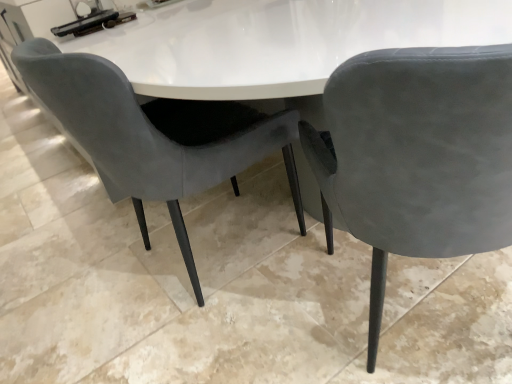
Describe the element at coordinates (155, 135) in the screenshot. The height and width of the screenshot is (384, 512). I see `suede gray chair at center, which is the 2th chair from right to left` at that location.

This screenshot has width=512, height=384. I want to click on suede gray chair at center, acting as the 1th chair starting from the left, so click(155, 135).

The image size is (512, 384). Describe the element at coordinates (417, 156) in the screenshot. I see `suede gray chair at center, which ranks as the second chair in left-to-right order` at that location.

What is the approximate height of suede gray chair at center, the first chair when ordered from right to left?

It is 32.70 inches.

Measure the distance between point [394,86] and camera.

They are 21.57 inches apart.

This screenshot has height=384, width=512. What are the coordinates of `suede gray chair at center, the first chair when ordered from right to left` in the screenshot? It's located at pyautogui.click(x=417, y=156).

At what (x,y) coordinates should I click in order to perform the action: click on suede gray chair at center, acting as the 1th chair starting from the left. Please return your answer as a coordinate pair (x, y). This screenshot has height=384, width=512. Looking at the image, I should click on tap(155, 135).

Based on their positions, is suede gray chair at center, which is the 2th chair from right to left, located to the left or right of suede gray chair at center, which ranks as the second chair in left-to-right order?

In the image, suede gray chair at center, which is the 2th chair from right to left, appears on the left side of suede gray chair at center, which ranks as the second chair in left-to-right order.

Considering their positions, is suede gray chair at center, acting as the 1th chair starting from the left, located in front of or behind suede gray chair at center, the first chair when ordered from right to left?

suede gray chair at center, acting as the 1th chair starting from the left, is positioned farther from the viewer than suede gray chair at center, the first chair when ordered from right to left.

Which is more distant, (x=136, y=147) or (x=458, y=202)?

The point (x=136, y=147) is farther from the camera.

From the image's perspective, between suede gray chair at center, which is the 2th chair from right to left, and suede gray chair at center, the first chair when ordered from right to left, who is located below?

suede gray chair at center, the first chair when ordered from right to left, is shown below in the image.

From a real-world perspective, is suede gray chair at center, which is the 2th chair from right to left, on top of suede gray chair at center, which ranks as the second chair in left-to-right order?

Yes, from a real-world perspective, suede gray chair at center, which is the 2th chair from right to left, is on top of suede gray chair at center, which ranks as the second chair in left-to-right order.

Can you confirm if suede gray chair at center, acting as the 1th chair starting from the left, is wider than suede gray chair at center, the first chair when ordered from right to left?

Incorrect, the width of suede gray chair at center, acting as the 1th chair starting from the left, does not surpass that of suede gray chair at center, the first chair when ordered from right to left.

Which of these two, suede gray chair at center, acting as the 1th chair starting from the left, or suede gray chair at center, which ranks as the second chair in left-to-right order, stands taller?

suede gray chair at center, which ranks as the second chair in left-to-right order.

Does suede gray chair at center, which is the 2th chair from right to left, have a larger size compared to suede gray chair at center, which ranks as the second chair in left-to-right order?

Indeed, suede gray chair at center, which is the 2th chair from right to left, has a larger size compared to suede gray chair at center, which ranks as the second chair in left-to-right order.

Is suede gray chair at center, which is the 2th chair from right to left, inside the boundaries of suede gray chair at center, the first chair when ordered from right to left, or outside?

suede gray chair at center, which is the 2th chair from right to left, lies outside suede gray chair at center, the first chair when ordered from right to left.

Is suede gray chair at center, which is the 2th chair from right to left, next to suede gray chair at center, which ranks as the second chair in left-to-right order, and touching it?

There is a gap between suede gray chair at center, which is the 2th chair from right to left, and suede gray chair at center, which ranks as the second chair in left-to-right order.

Is suede gray chair at center, acting as the 1th chair starting from the left, turned away from suede gray chair at center, the first chair when ordered from right to left?

suede gray chair at center, acting as the 1th chair starting from the left, does not have its back to suede gray chair at center, the first chair when ordered from right to left.

How many degrees apart are the facing directions of suede gray chair at center, acting as the 1th chair starting from the left, and suede gray chair at center, the first chair when ordered from right to left?

They differ by 60.9 degrees in their facing directions.

In order to click on chair on the left of suede gray chair at center, the first chair when ordered from right to left in this screenshot , I will do `click(155, 135)`.

In the image, is suede gray chair at center, which ranks as the second chair in left-to-right order, on the left side or the right side of suede gray chair at center, which is the 2th chair from right to left?

suede gray chair at center, which ranks as the second chair in left-to-right order, is to the right of suede gray chair at center, which is the 2th chair from right to left.

Considering the relative positions of suede gray chair at center, the first chair when ordered from right to left, and suede gray chair at center, which is the 2th chair from right to left, in the image provided, is suede gray chair at center, the first chair when ordered from right to left, behind suede gray chair at center, which is the 2th chair from right to left,?

No.

Is point (511, 219) closer to viewer compared to point (130, 182)?

Yes, it is in front of point (130, 182).

From the image's perspective, is suede gray chair at center, the first chair when ordered from right to left, above or below suede gray chair at center, acting as the 1th chair starting from the left?

suede gray chair at center, the first chair when ordered from right to left, is below suede gray chair at center, acting as the 1th chair starting from the left.

From a real-world perspective, is suede gray chair at center, which ranks as the second chair in left-to-right order, below suede gray chair at center, which is the 2th chair from right to left?

Yes, from a real-world perspective, suede gray chair at center, which ranks as the second chair in left-to-right order, is below suede gray chair at center, which is the 2th chair from right to left.

Looking at their sizes, would you say suede gray chair at center, which ranks as the second chair in left-to-right order, is wider or thinner than suede gray chair at center, acting as the 1th chair starting from the left?

In the image, suede gray chair at center, which ranks as the second chair in left-to-right order, appears to be wider than suede gray chair at center, acting as the 1th chair starting from the left.

From their relative heights in the image, would you say suede gray chair at center, the first chair when ordered from right to left, is taller or shorter than suede gray chair at center, which is the 2th chair from right to left?

suede gray chair at center, the first chair when ordered from right to left, is taller than suede gray chair at center, which is the 2th chair from right to left.

Looking at this image, between suede gray chair at center, the first chair when ordered from right to left, and suede gray chair at center, which is the 2th chair from right to left, which one has larger size?

suede gray chair at center, which is the 2th chair from right to left.

Is suede gray chair at center, which ranks as the second chair in left-to-right order, outside of suede gray chair at center, acting as the 1th chair starting from the left?

suede gray chair at center, which ranks as the second chair in left-to-right order, lies outside suede gray chair at center, acting as the 1th chair starting from the left,'s area.

Would you consider suede gray chair at center, the first chair when ordered from right to left, to be distant from suede gray chair at center, which is the 2th chair from right to left?

suede gray chair at center, the first chair when ordered from right to left, is near suede gray chair at center, which is the 2th chair from right to left, not far away.

Is suede gray chair at center, the first chair when ordered from right to left, oriented away from suede gray chair at center, which is the 2th chair from right to left?

suede gray chair at center, the first chair when ordered from right to left, is not turned away from suede gray chair at center, which is the 2th chair from right to left.

Can you tell me how much suede gray chair at center, the first chair when ordered from right to left, and suede gray chair at center, which is the 2th chair from right to left, differ in facing direction?

There is a 60.9-degree angle between the facing directions of suede gray chair at center, the first chair when ordered from right to left, and suede gray chair at center, which is the 2th chair from right to left.

Image resolution: width=512 pixels, height=384 pixels. Identify the location of chair behind the suede gray chair at center, which ranks as the second chair in left-to-right order. (155, 135).

This screenshot has width=512, height=384. Find the location of `chair that is below the suede gray chair at center, acting as the 1th chair starting from the left (from the image's perspective)`. chair that is below the suede gray chair at center, acting as the 1th chair starting from the left (from the image's perspective) is located at coordinates click(417, 156).

At what (x,y) coordinates should I click in order to perform the action: click on chair that is in front of the suede gray chair at center, acting as the 1th chair starting from the left. Please return your answer as a coordinate pair (x, y). Looking at the image, I should click on (417, 156).